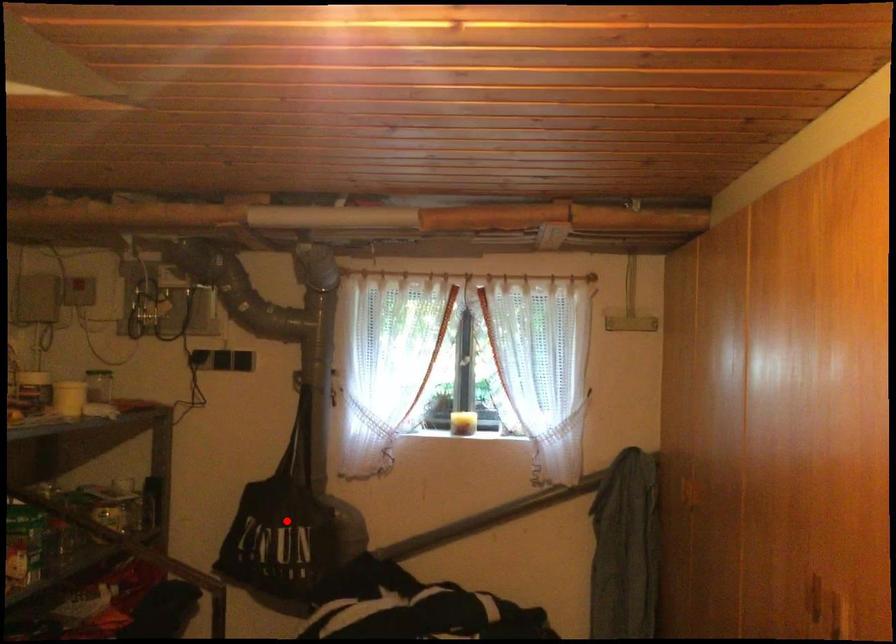
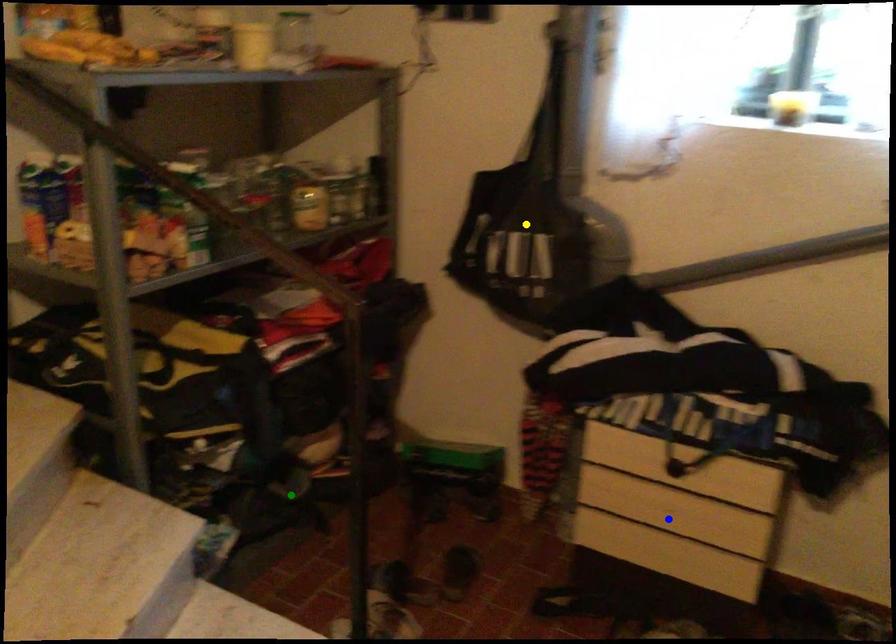
Question: I am providing you with two images of the same scene from different viewpoints. A red point is marked on the first image. You are given multiple points on the second image. Which point in image 2 is actually the same real-world point as the red point in image 1?

Choices:
 (A) yellow point
 (B) blue point
 (C) green point

Answer: (A)